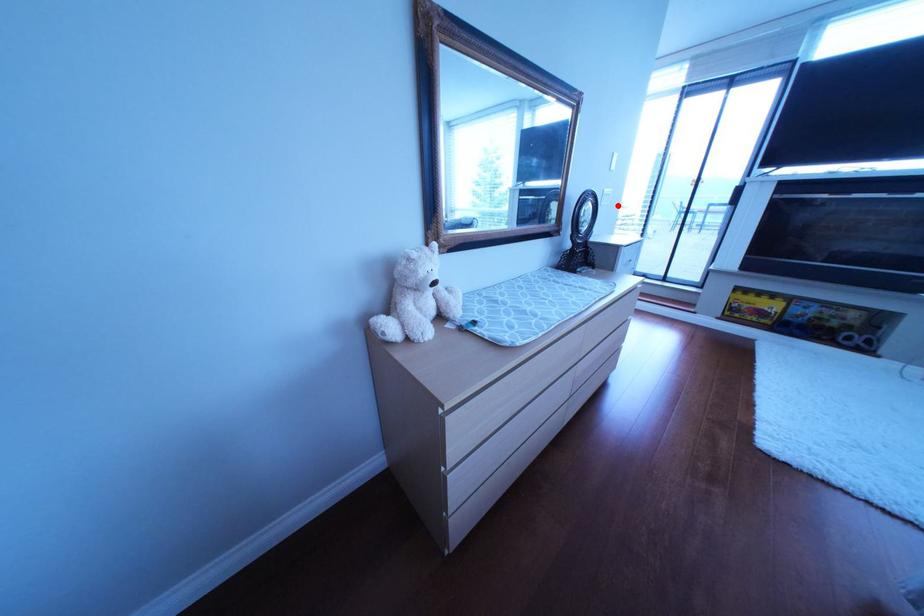
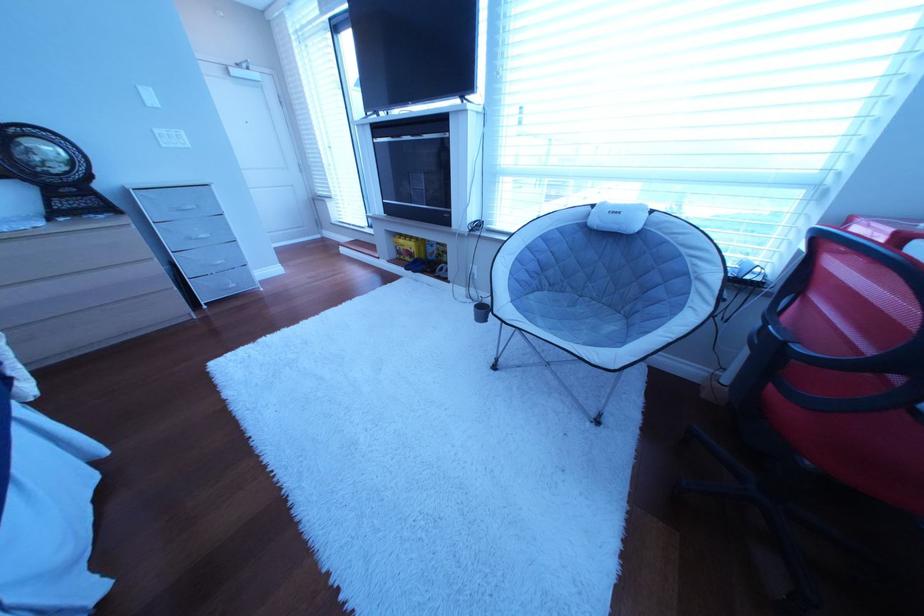
In the second image, find the point that corresponds to the highlighted location in the first image.

(179, 148)